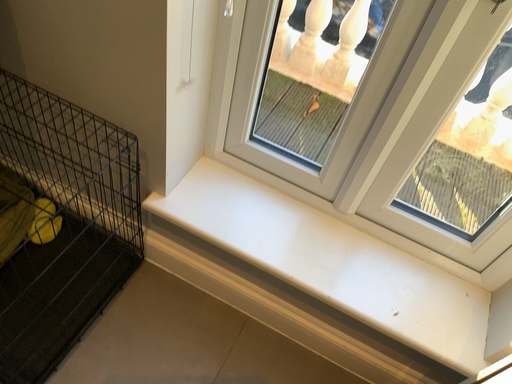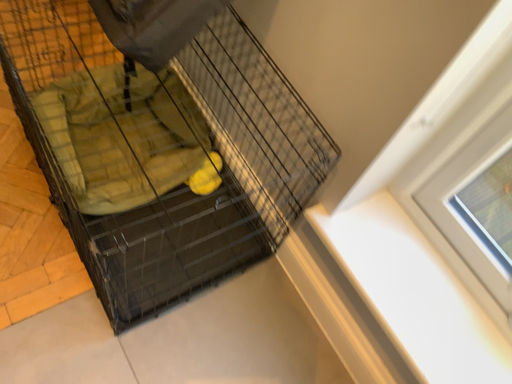
Question: How did the camera likely rotate when shooting the video?

Choices:
 (A) rotated right
 (B) rotated left

Answer: (B)